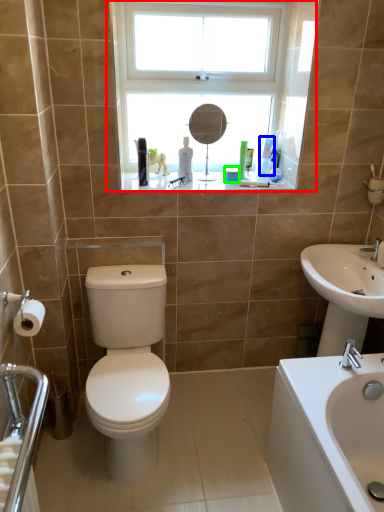
Question: Based on their relative distances, which object is nearer to window (highlighted by a red box)? Choose from toiletry (highlighted by a blue box) and toiletry (highlighted by a green box).

Choices:
 (A) toiletry
 (B) toiletry

Answer: (A)